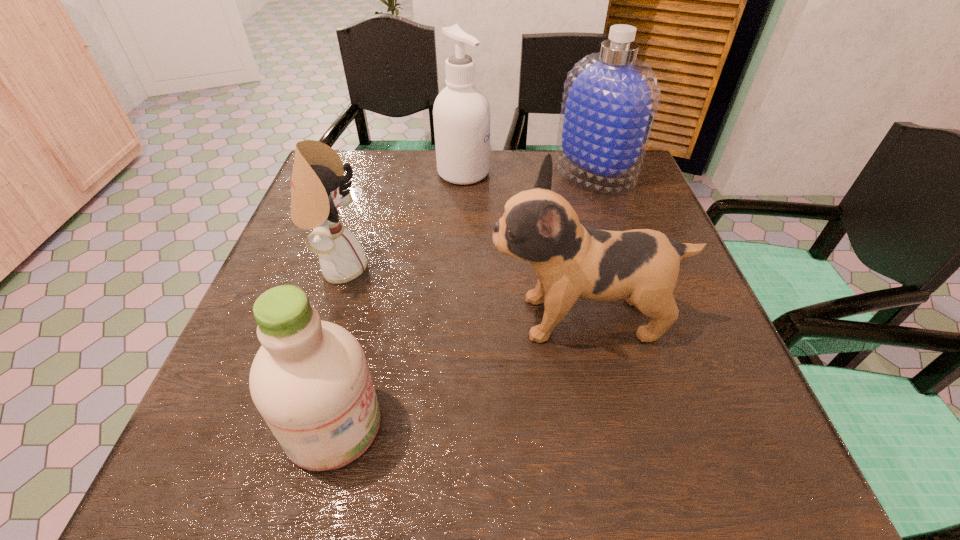
In the image, there is a desktop. Where is `blank space at the far edge`? blank space at the far edge is located at coordinates point(461,192).

In the image, there is a desktop. Identify the location of vacant space at the near edge. This screenshot has height=540, width=960. (668, 468).

In the image, there is a desktop. Where is `vacant space at the right edge`? The image size is (960, 540). vacant space at the right edge is located at coordinates (649, 373).

I want to click on free space at the near right corner of the desktop, so click(743, 471).

At what (x,y) coordinates should I click in order to perform the action: click on free space that is in between the second cleansing agent from left to right and the nearest object. Please return your answer as a coordinate pair (x, y). Image resolution: width=960 pixels, height=540 pixels. Looking at the image, I should click on (398, 299).

Where is `vacant region between the shortest cleansing agent and the second cleansing agent from left to right`? Image resolution: width=960 pixels, height=540 pixels. vacant region between the shortest cleansing agent and the second cleansing agent from left to right is located at coordinates (398, 299).

Find the location of a particular element. free spot between the rightmost cleansing agent and the shortest cleansing agent is located at coordinates (464, 299).

Where is `free area in between the doll and the puppy`? free area in between the doll and the puppy is located at coordinates (460, 293).

Identify the location of free space between the doll and the rightmost cleansing agent. Image resolution: width=960 pixels, height=540 pixels. [467, 221].

You are a GUI agent. You are given a task and a screenshot of the screen. Output one action in this format:
    pyautogui.click(x=<x>, y=<y>)
    Task: Click on the unoccupied position between the second cleansing agent from right to left and the shortest cleansing agent
    The width and height of the screenshot is (960, 540).
    Given the screenshot: What is the action you would take?
    pyautogui.click(x=398, y=299)